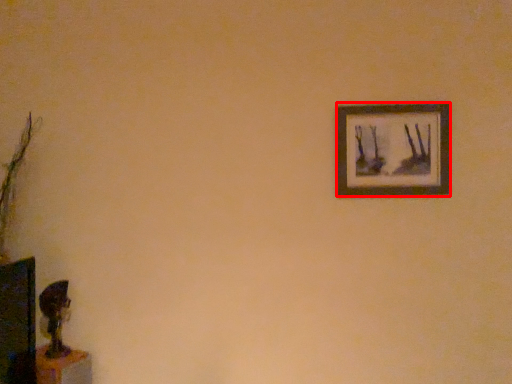
Question: From the image, what is the correct spatial relationship of picture frame (annotated by the red box) in relation to table?

Choices:
 (A) left
 (B) right

Answer: (B)